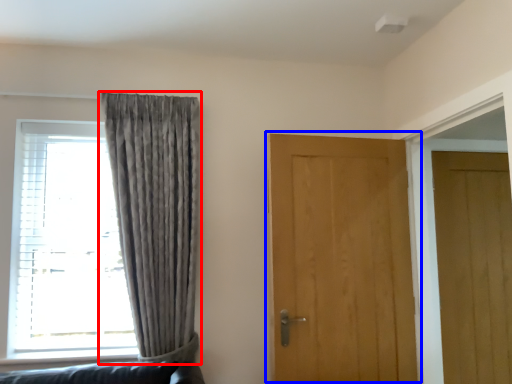
Question: Which point is closer to the camera, curtain (highlighted by a red box) or door (highlighted by a blue box)?

Choices:
 (A) curtain
 (B) door

Answer: (A)